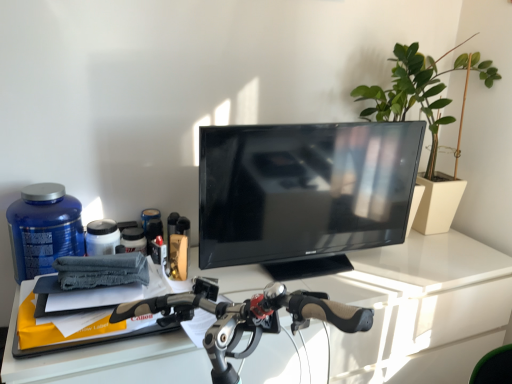
Question: Which is correct: black glossy tv at center is inside green matte plant at upper right, or outside of it?

Choices:
 (A) outside
 (B) inside

Answer: (A)

Question: Considering the positions of black glossy tv at center and green matte plant at upper right in the image, is black glossy tv at center taller or shorter than green matte plant at upper right?

Choices:
 (A) short
 (B) tall

Answer: (A)

Question: Which is nearer to the white glossy desk at center?

Choices:
 (A) blue matte bottle at left
 (B) green matte plant at upper right
 (C) black glossy tv at center

Answer: (C)

Question: Which is nearer to the blue matte bottle at left?

Choices:
 (A) black glossy tv at center
 (B) white glossy desk at center
 (C) green matte plant at upper right

Answer: (B)